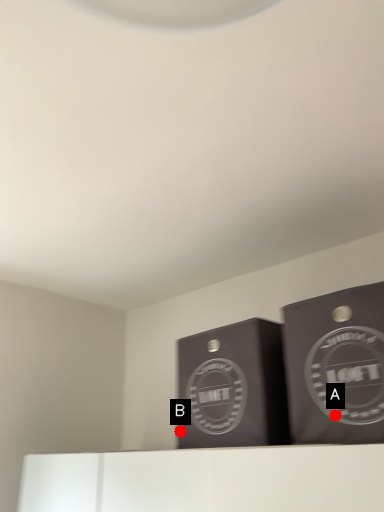
Question: Two points are circled on the image, labeled by A and B beside each circle. Which point appears farthest from the camera in this image?

Choices:
 (A) A is further
 (B) B is further

Answer: (B)